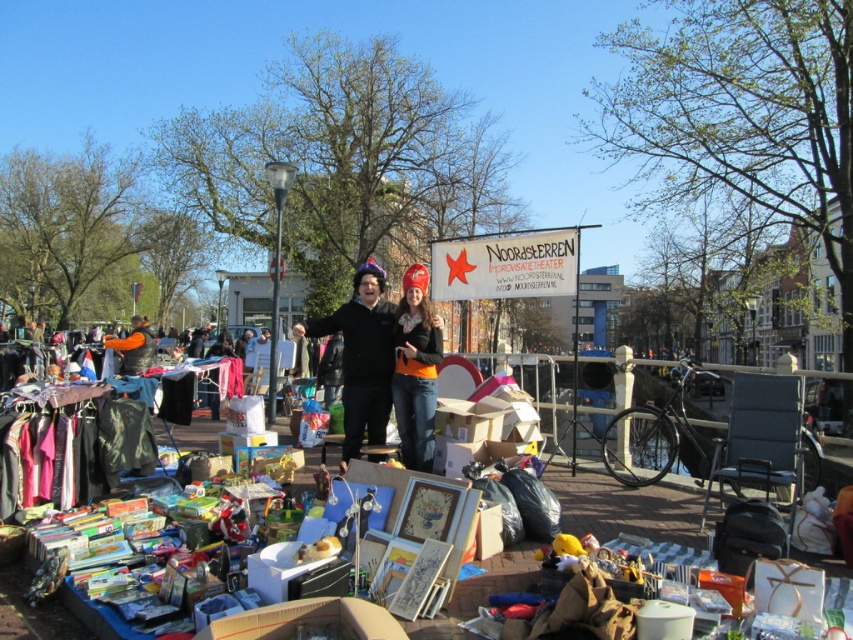
Question: Which object appears farthest from the camera in this image?

Choices:
 (A) orange fabric pants at center
 (B) black cotton hoodie at center

Answer: (B)

Question: Based on their relative distances, which object is nearer to the orange fabric pants at center?

Choices:
 (A) orange fleece vest at center
 (B) wooden table at center
 (C) orange fabric jacket at center

Answer: (B)

Question: Which point is closer to the camera taking this photo?

Choices:
 (A) (387, 304)
 (B) (476, 358)
 (C) (148, 330)

Answer: (A)

Question: Does wooden table at center appear on the right side of black cotton hoodie at center?

Choices:
 (A) yes
 (B) no

Answer: (A)

Question: Is the position of black cotton hoodie at center less distant than that of orange fleece vest at center?

Choices:
 (A) yes
 (B) no

Answer: (A)

Question: Can you confirm if wooden table at center is bigger than orange fabric pants at center?

Choices:
 (A) yes
 (B) no

Answer: (A)